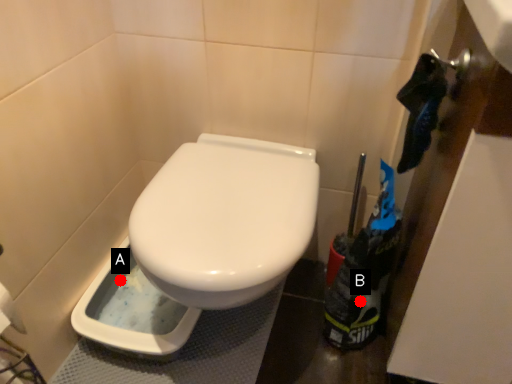
Question: Two points are circled on the image, labeled by A and B beside each circle. Which point is farther to the camera?

Choices:
 (A) A is further
 (B) B is further

Answer: (A)